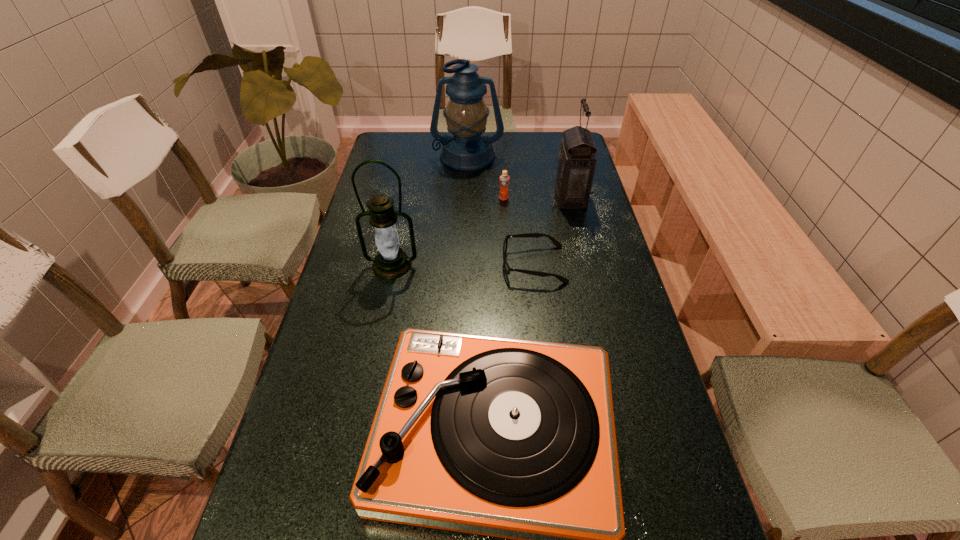
The image size is (960, 540). I want to click on free space at the far left corner of the desktop, so click(411, 146).

Identify the location of vacant space in between the second shortest object and the spectacles. (518, 231).

Identify the location of vacant point located between the nearest lantern and the shortest object. The image size is (960, 540). click(463, 265).

What are the coordinates of `free spot between the nearest lantern and the second shortest object` in the screenshot? It's located at (447, 232).

The width and height of the screenshot is (960, 540). I want to click on unoccupied area between the shortest object and the rightmost lantern, so click(552, 231).

You are a GUI agent. You are given a task and a screenshot of the screen. Output one action in this format:
    pyautogui.click(x=<x>, y=<y>)
    Task: Click on the free spot between the second nearest lantern and the second shortest object
    
    Given the screenshot: What is the action you would take?
    pyautogui.click(x=537, y=198)

Find the location of a particular element. This screenshot has width=960, height=540. free spot between the nearest lantern and the shortest object is located at coordinates (463, 265).

Locate an element on the screen. This screenshot has width=960, height=540. empty location between the farthest lantern and the rightmost lantern is located at coordinates (519, 177).

Where is `vacant area between the orange juice and the farthest object`? vacant area between the orange juice and the farthest object is located at coordinates (486, 177).

Select which object is the third closest to the rightmost lantern. Please provide its 2D coordinates. Your answer should be formatted as a tuple, i.e. [(x, y)], where the tuple contains the x and y coordinates of a point satisfying the conditions above.

[(467, 149)]